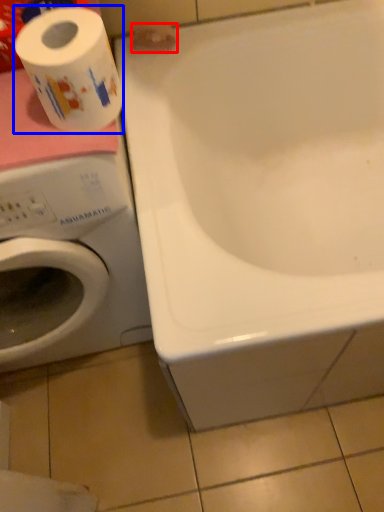
Question: Which object appears farthest to the camera in this image, toilet paper (highlighted by a red box) or toilet paper (highlighted by a blue box)?

Choices:
 (A) toilet paper
 (B) toilet paper

Answer: (A)